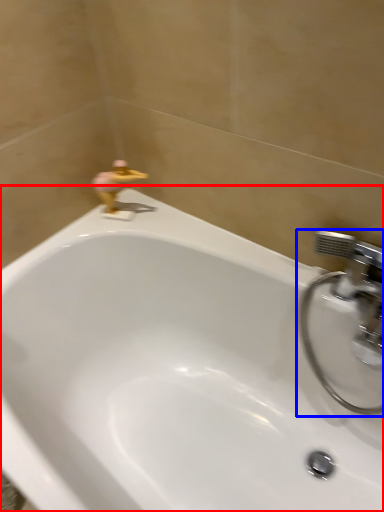
Question: Which of the following is the farthest to the observer, bathtub (highlighted by a red box) or tap (highlighted by a blue box)?

Choices:
 (A) bathtub
 (B) tap

Answer: (B)